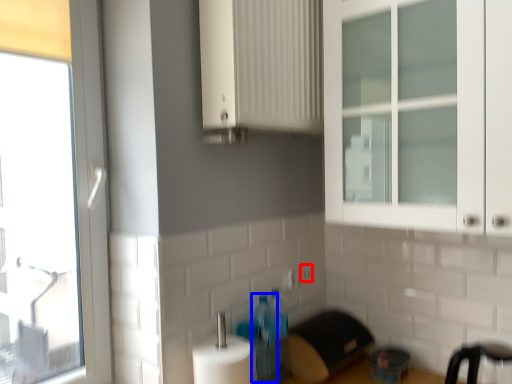
Question: Which of the following is the farthest to the observer, electric outlet (highlighted by a red box) or bottle (highlighted by a blue box)?

Choices:
 (A) electric outlet
 (B) bottle

Answer: (A)